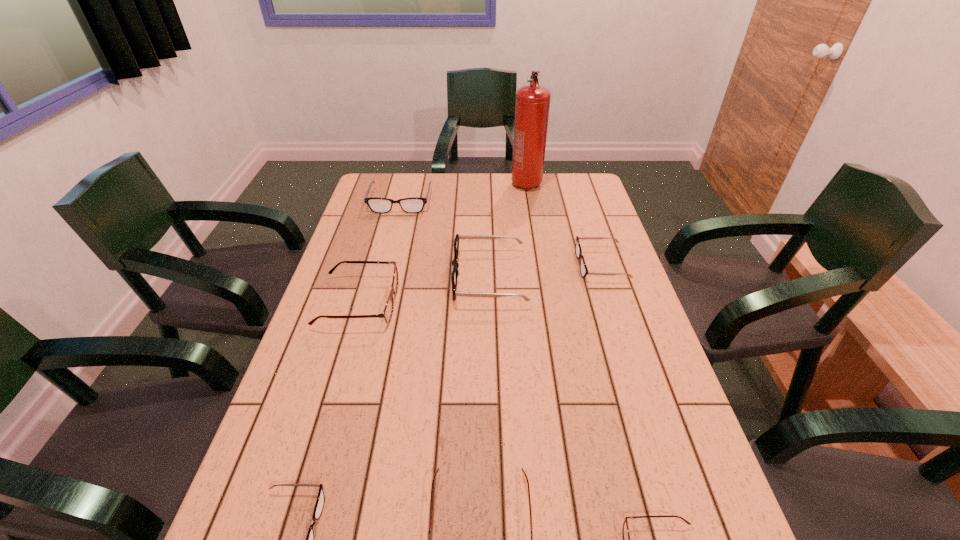
Locate an element on the screen. Image resolution: width=960 pixels, height=540 pixels. free space located 0.370m on the front-facing side of the biggest black spectacles is located at coordinates (328, 278).

You are a GUI agent. You are given a task and a screenshot of the screen. Output one action in this format:
    pyautogui.click(x=<x>, y=<y>)
    Task: Click on the vacant region located on the front-facing side of the biggest black spectacles
    The image size is (960, 540).
    Given the screenshot: What is the action you would take?
    pyautogui.click(x=386, y=278)

Where is `blank space located 0.290m on the front-facing side of the biggest black spectacles`? Image resolution: width=960 pixels, height=540 pixels. blank space located 0.290m on the front-facing side of the biggest black spectacles is located at coordinates (355, 278).

This screenshot has height=540, width=960. What are the coordinates of `blank area located 0.240m on the front-facing side of the farthest spectacles` in the screenshot? It's located at (386, 255).

Identify the location of vacant space situated 0.050m on the lenses of the leftmost red spectacles. (414, 302).

Where is `free location located on the front-facing side of the second smallest black spectacles`? This screenshot has height=540, width=960. free location located on the front-facing side of the second smallest black spectacles is located at coordinates (451, 265).

Where is `free region located on the front-facing side of the second smallest black spectacles`? Image resolution: width=960 pixels, height=540 pixels. free region located on the front-facing side of the second smallest black spectacles is located at coordinates (532, 265).

Identify the location of free space located 0.390m on the front-facing side of the second smallest black spectacles. (451, 265).

Locate an element on the screen. The height and width of the screenshot is (540, 960). fire extinguisher situated at the far edge is located at coordinates (532, 103).

You are a GUI agent. You are given a task and a screenshot of the screen. Output one action in this format:
    pyautogui.click(x=<x>, y=<y>)
    Task: Click on the spectacles positioned at the far edge
    
    Given the screenshot: What is the action you would take?
    click(x=414, y=204)